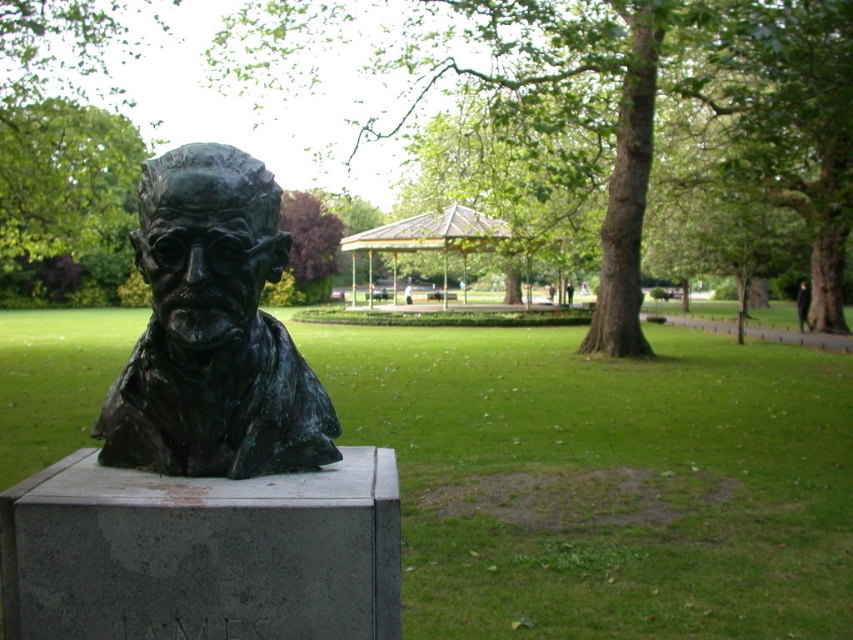
Question: Does green leafy tree at left come in front of metallic gazebo at center?

Choices:
 (A) yes
 (B) no

Answer: (A)

Question: Estimate the real-world distances between objects in this image. Which object is closer to the metallic gazebo at center?

Choices:
 (A) bronze statue at center
 (B) green patina bronze bust at center

Answer: (A)

Question: Can you confirm if bronze statue at center is bigger than green leafy tree at left?

Choices:
 (A) no
 (B) yes

Answer: (A)

Question: Estimate the real-world distances between objects in this image. Which object is farther from the bronze statue at center?

Choices:
 (A) green leafy tree at center
 (B) green leafy tree at left
 (C) green patina bronze bust at center
 (D) metallic gazebo at center

Answer: (D)

Question: Which point is farther to the camera?

Choices:
 (A) (15, 120)
 (B) (830, 452)
 (C) (491, 228)

Answer: (C)

Question: Does bronze statue at center appear under green leafy tree at center?

Choices:
 (A) yes
 (B) no

Answer: (A)